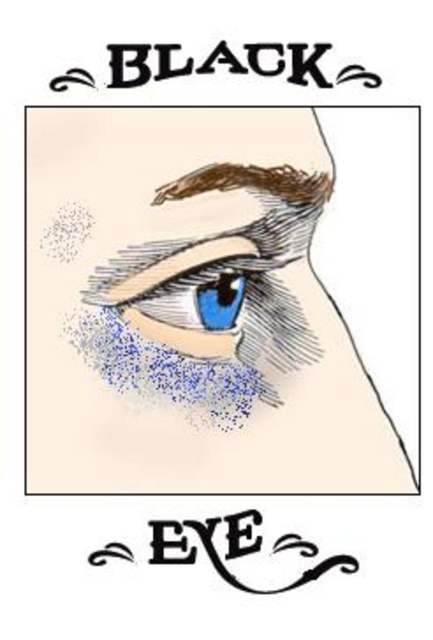
From the picture: Does blue glossy eye at center have a greater width compared to brown textured eyebrow at upper center?

In fact, blue glossy eye at center might be narrower than brown textured eyebrow at upper center.

Is blue glossy eye at center smaller than brown textured eyebrow at upper center?

Actually, blue glossy eye at center might be larger than brown textured eyebrow at upper center.

Find the location of `blue glossy eye at center`. blue glossy eye at center is located at coordinates (186, 296).

Where is `blue glossy eye at center`? blue glossy eye at center is located at coordinates (186, 296).

Looking at this image, can you confirm if matte black eye at upper center is thinner than brown textured eyebrow at upper center?

No.

Is matte black eye at upper center further to camera compared to brown textured eyebrow at upper center?

That is True.

Does point (158, 301) come behind point (280, 168)?

No, (158, 301) is closer to viewer.

Image resolution: width=433 pixels, height=640 pixels. What are the coordinates of `matte black eye at upper center` in the screenshot? It's located at (190, 308).

Does matte black eye at upper center have a greater width compared to blue glossy eye at center?

Indeed, matte black eye at upper center has a greater width compared to blue glossy eye at center.

Is point (136, 202) more distant than point (183, 328)?

No, (136, 202) is in front of (183, 328).

Find the location of `matte black eye at upper center`. matte black eye at upper center is located at coordinates (190, 308).